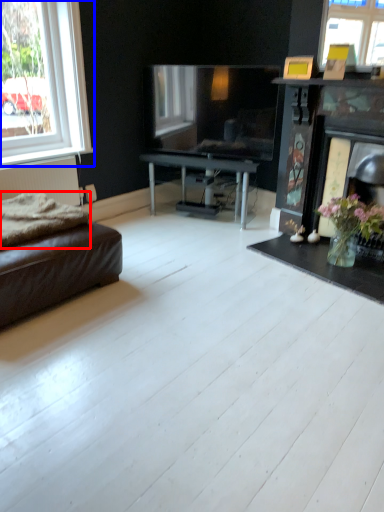
Question: Which object appears farthest to the camera in this image, blanket (highlighted by a red box) or window (highlighted by a blue box)?

Choices:
 (A) blanket
 (B) window

Answer: (B)